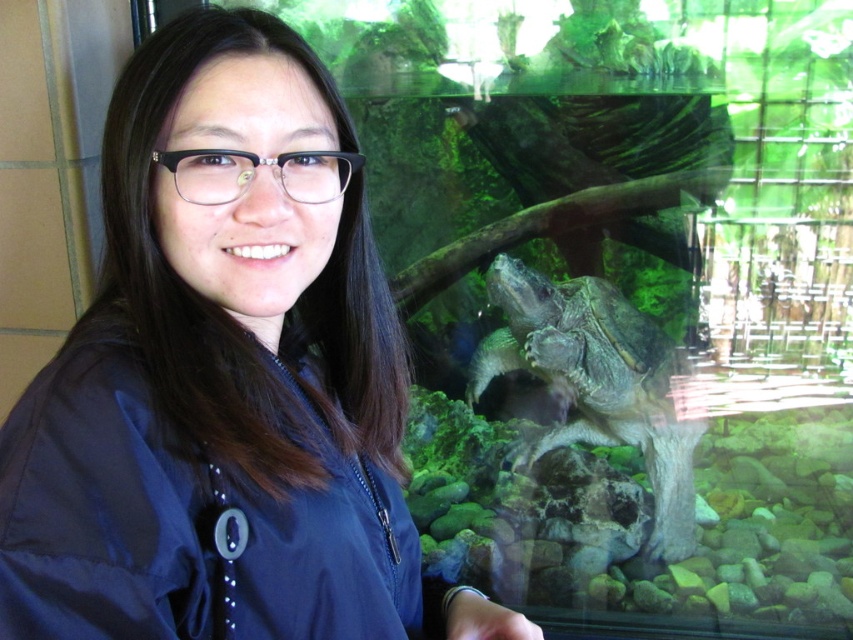
Can you confirm if blue fabric at center is wider than smooth gray tortoise at center?

Incorrect, blue fabric at center's width does not surpass smooth gray tortoise at center's.

Is blue fabric at center bigger than smooth gray tortoise at center?

Indeed, blue fabric at center has a larger size compared to smooth gray tortoise at center.

Locate an element on the screen. The width and height of the screenshot is (853, 640). blue fabric at center is located at coordinates (225, 378).

Locate an element on the screen. blue fabric at center is located at coordinates (225, 378).